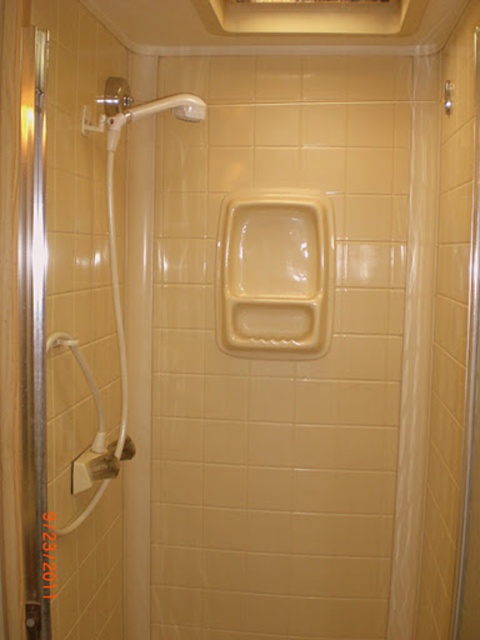
Can you confirm if beige matte urinal at center is positioned to the left of clear plastic shower curtain at right?

Yes, beige matte urinal at center is to the left of clear plastic shower curtain at right.

Between beige matte urinal at center and clear plastic shower curtain at right, which one is positioned higher?

beige matte urinal at center is higher up.

Image resolution: width=480 pixels, height=640 pixels. What are the coordinates of `beige matte urinal at center` in the screenshot? It's located at (276, 273).

At what (x,y) coordinates should I click in order to perform the action: click on beige matte urinal at center. Please return your answer as a coordinate pair (x, y). The width and height of the screenshot is (480, 640). Looking at the image, I should click on (276, 273).